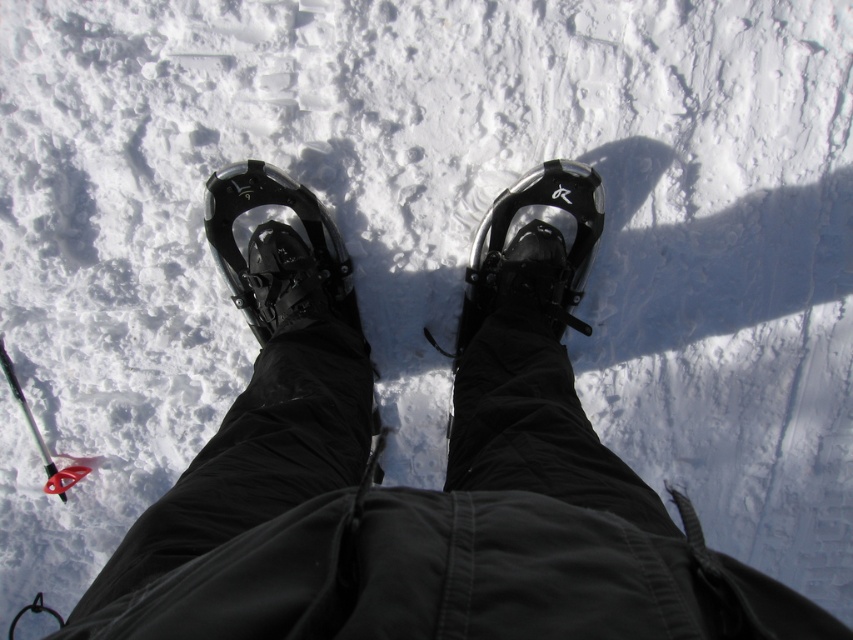
Does black matte snowshoes at center lie behind black glossy snowshoe at center?

That is False.

Who is more forward, [355,588] or [224,211]?

Point [355,588]

Which is in front, point (569, 410) or point (328, 276)?

Point (569, 410)

Image resolution: width=853 pixels, height=640 pixels. I want to click on black matte snowshoes at center, so click(416, 488).